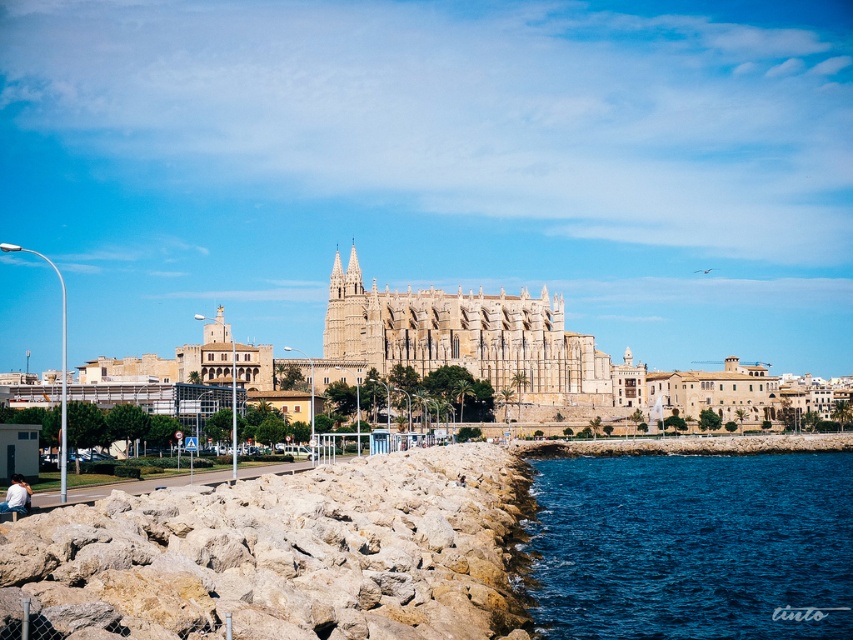
You are a tourist visiting the coastal cathedral area. You see the rocky at lower left and the white cotton shirt at lower left. Which object is closer to the water?

The rocky at lower left is taller than the white cotton shirt at lower left, so the rocky at lower left is closer to the water.

You are standing at the camera position overlooking the coastal cathedral scene. You want to reach the blue liquid water at lower right without moving your position. Is it possible to touch the water with a 300 feet long fishing rod?

Answer: The blue liquid water at lower right is 270.45 feet away from the camera. Since the fishing rod is 300 feet long, which is longer than the distance, you can touch the water with it.

You are standing at the center of the paved road near the rocky shoreline. You want to reach the blue liquid water at lower right. Which direction should you walk to get there?

The blue liquid water at lower right is located at point (691, 545), so you should walk towards the lower right direction to reach it.